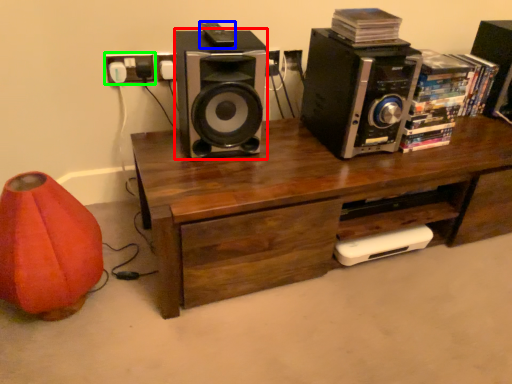
Question: Considering the real-world distances, which object is farthest from speaker (highlighted by a red box)? ipod (highlighted by a blue box) or electric outlet (highlighted by a green box)?

Choices:
 (A) ipod
 (B) electric outlet

Answer: (B)